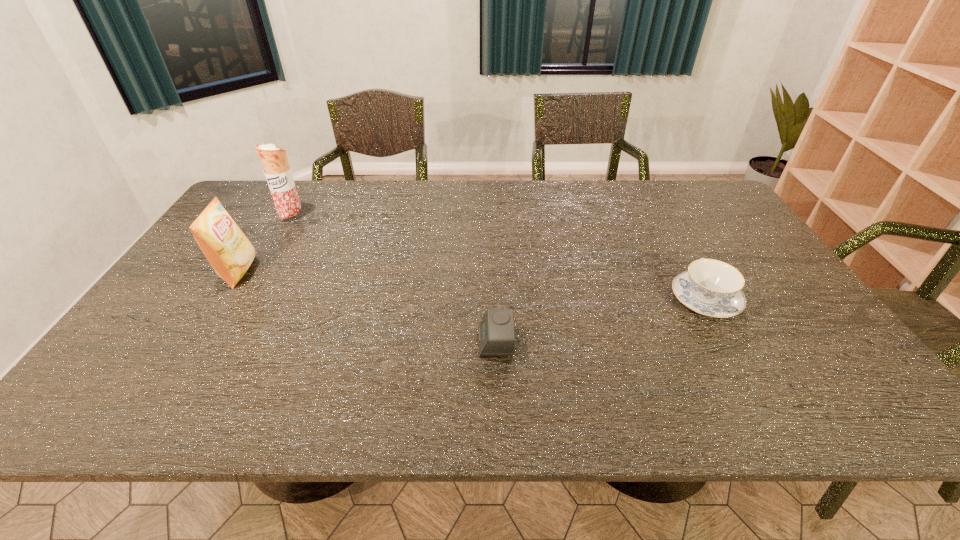
The height and width of the screenshot is (540, 960). Find the location of `free space that satisfies the following two spatial constraints: 1. on the front-facing side of the crisp (potato chip); 2. with the handle on the side of the chinaware`. free space that satisfies the following two spatial constraints: 1. on the front-facing side of the crisp (potato chip); 2. with the handle on the side of the chinaware is located at coordinates point(222,299).